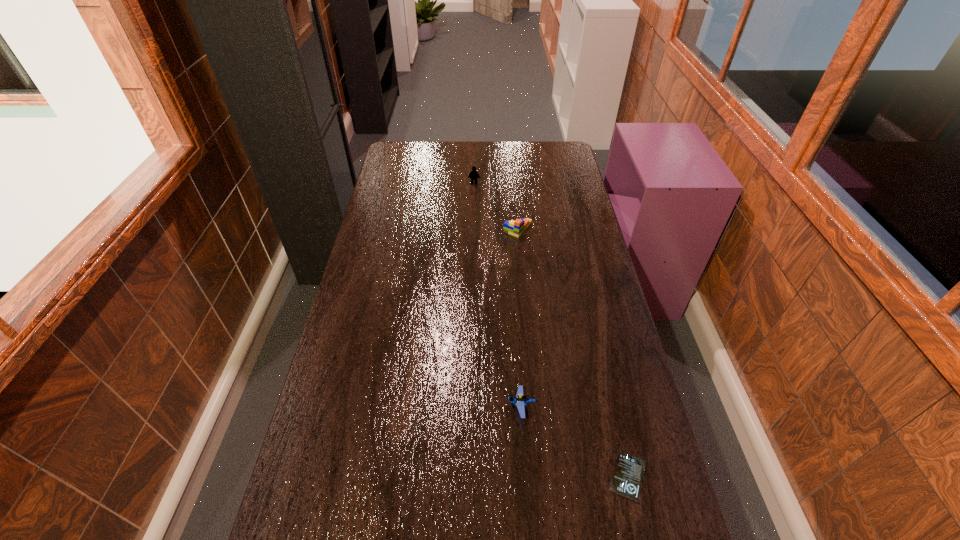
At what (x,y) coordinates should I click in order to perform the action: click on vacant space situated 0.180m on the front-facing side of the shortest Lego. Please return your answer as a coordinate pair (x, y). Looking at the image, I should click on (440, 407).

Image resolution: width=960 pixels, height=540 pixels. Identify the location of vacant space located 0.290m on the front-facing side of the shortest Lego. (399, 407).

Find the location of a particular element. vacant space located 0.250m on the front-facing side of the shortest Lego is located at coordinates (414, 407).

You are a GUI agent. You are given a task and a screenshot of the screen. Output one action in this format:
    pyautogui.click(x=<x>, y=<y>)
    Task: Click on the free region located on the back of the nearest object
    The height and width of the screenshot is (540, 960).
    Given the screenshot: What is the action you would take?
    pyautogui.click(x=597, y=343)

Where is `object at the right edge`? The width and height of the screenshot is (960, 540). object at the right edge is located at coordinates (627, 477).

Where is `vacant area at the far edge`? The width and height of the screenshot is (960, 540). vacant area at the far edge is located at coordinates tap(454, 143).

Locate an element on the screen. free space at the left edge of the desktop is located at coordinates (354, 274).

Identify the location of vacant space at the right edge of the desktop. (552, 192).

At what (x,y) coordinates should I click in order to perform the action: click on vacant region at the far left corner of the desktop. Please return your answer as a coordinate pair (x, y). The image size is (960, 540). Looking at the image, I should click on (399, 154).

Locate an element on the screen. The image size is (960, 540). free space at the far right corner of the desktop is located at coordinates (549, 164).